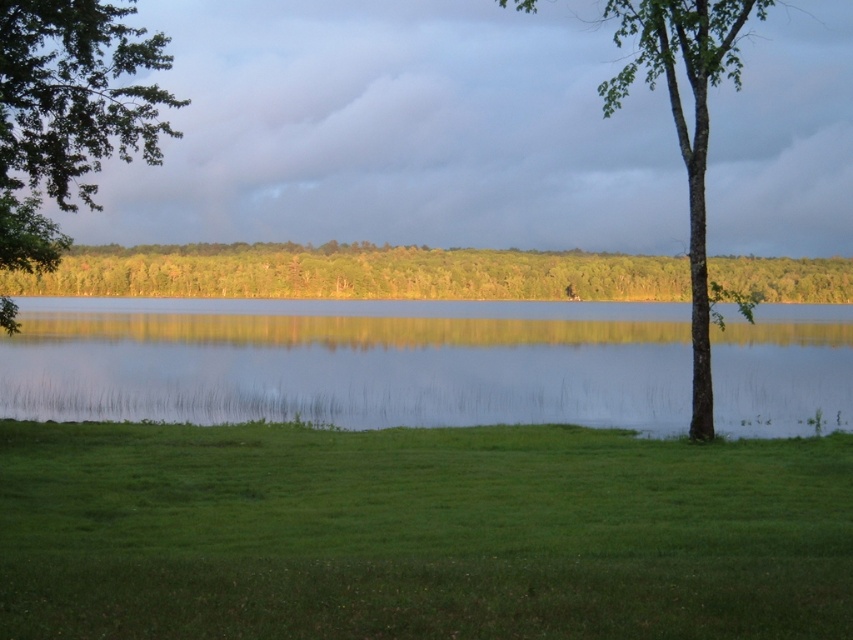
You are standing at the lakeside and want to take a photo of the green leafy tree at upper left without the green grassy at lower center blocking the view. Is this possible?

The green grassy at lower center is in front of the green leafy tree at upper left, so it will block the view. To avoid the grassy area blocking the tree, you need to move to a position where the tree is no longer behind the grassy area or adjust your angle so that the tree is visible beyond the grassy area.

You are standing at the point with coordinates (354,273) in the image. What object are you directly facing?

The point at coordinates (354,273) corresponds to the green leafy tree at center, so you are directly facing the green leafy tree at center.